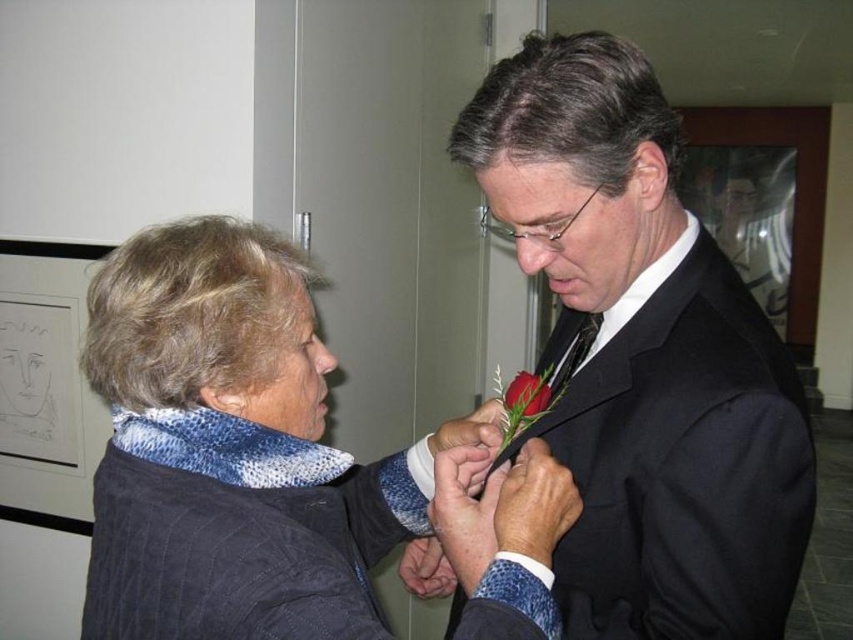
Question: Estimate the real-world distances between objects in this image. Which object is farther from the black satin suit at center?

Choices:
 (A) red velvet rose at center
 (B) blue textured scarf at left

Answer: (A)

Question: Among these points, which one is nearest to the camera?

Choices:
 (A) (647, 196)
 (B) (529, 380)
 (C) (395, 525)

Answer: (A)

Question: Which of the following is the closest to the observer?

Choices:
 (A) (543, 387)
 (B) (693, 380)
 (C) (233, 506)

Answer: (C)

Question: Is blue textured scarf at left bigger than red velvet rose at center?

Choices:
 (A) no
 (B) yes

Answer: (B)

Question: From the image, what is the correct spatial relationship of black satin suit at center in relation to red velvet rose at center?

Choices:
 (A) above
 (B) below

Answer: (A)

Question: Considering the relative positions of black satin suit at center and red velvet rose at center in the image provided, where is black satin suit at center located with respect to red velvet rose at center?

Choices:
 (A) below
 (B) above

Answer: (B)